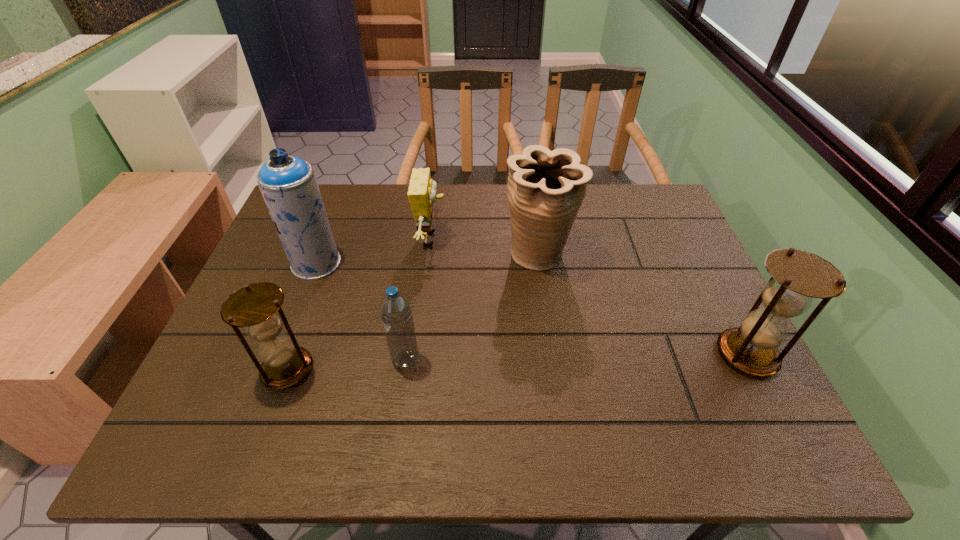
Please determine a free point for an extra hourglass to ensure balance. Please provide its 2D coordinates. Your answer should be formatted as a tuple, i.e. [(x, y)], where the tuple contains the x and y coordinates of a point satisfying the conditions above.

[(520, 362)]